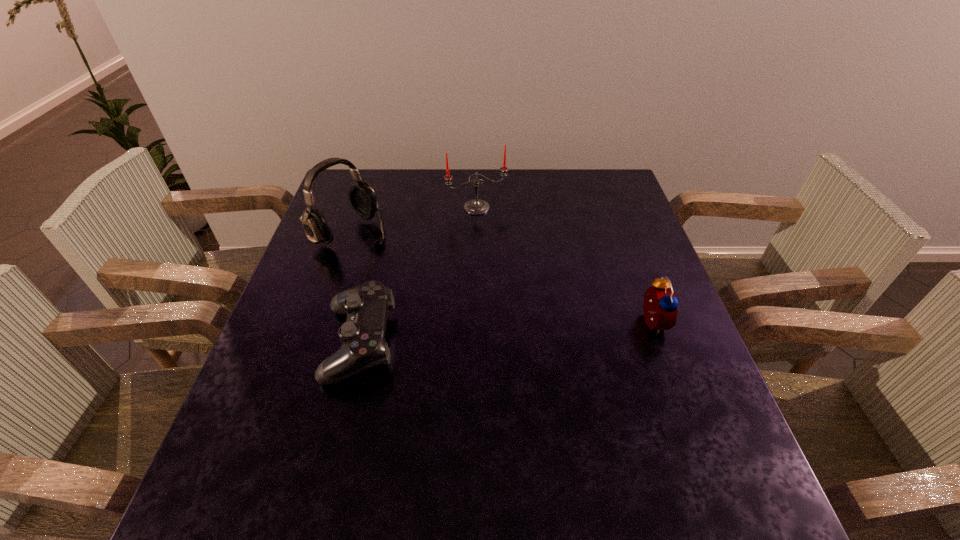
Find the location of a particular element. The height and width of the screenshot is (540, 960). vacant space at the far right corner of the desktop is located at coordinates (594, 198).

Locate an element on the screen. Image resolution: width=960 pixels, height=540 pixels. vacant space that is in between the second object from right to left and the third tallest object is located at coordinates (564, 265).

Find the location of a particular element. The width and height of the screenshot is (960, 540). unoccupied area between the third tallest object and the second object from right to left is located at coordinates (564, 265).

Locate an element on the screen. The width and height of the screenshot is (960, 540). empty location between the third object from left to right and the shortest object is located at coordinates (419, 275).

Find the location of a particular element. free space between the candle and the alarm clock is located at coordinates tap(564, 265).

Where is `vacant space that's between the second object from right to left and the third tallest object`? This screenshot has height=540, width=960. vacant space that's between the second object from right to left and the third tallest object is located at coordinates (564, 265).

Find the location of a particular element. The width and height of the screenshot is (960, 540). free area in between the third object from left to right and the shortest object is located at coordinates (419, 275).

I want to click on vacant area that lies between the headset and the alarm clock, so click(x=501, y=278).

This screenshot has height=540, width=960. Identify the location of empty location between the headset and the third object from left to right. (414, 220).

Find the location of a particular element. free space between the alarm clock and the headset is located at coordinates (501, 278).